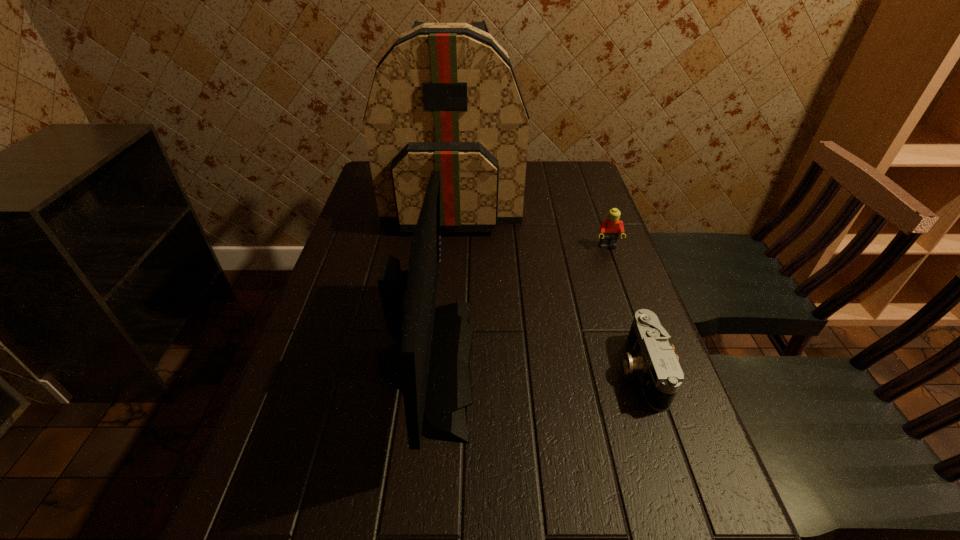
The width and height of the screenshot is (960, 540). In order to click on vacant space in between the second tallest object and the Lego in this screenshot , I will do `click(516, 305)`.

Image resolution: width=960 pixels, height=540 pixels. I want to click on free space between the farthest object and the camera, so click(547, 285).

I want to click on vacant space that is in between the monitor and the shortest object, so click(534, 367).

Locate an element on the screen. This screenshot has width=960, height=540. free point between the backpack and the third tallest object is located at coordinates (531, 223).

At what (x,y) coordinates should I click in order to perform the action: click on vacant area between the Lego and the third shortest object. Please return your answer as a coordinate pair (x, y). Looking at the image, I should click on (516, 305).

Find the location of a particular element. empty space between the second farthest object and the shortest object is located at coordinates click(625, 308).

The height and width of the screenshot is (540, 960). I want to click on free spot between the monitor and the third nearest object, so click(x=516, y=305).

Identify the location of free area in between the monitor and the backpack. This screenshot has width=960, height=540. (440, 281).

At what (x,y) coordinates should I click in order to perform the action: click on vacant space that is in between the monitor and the Lego. Please return your answer as a coordinate pair (x, y). The width and height of the screenshot is (960, 540). Looking at the image, I should click on (516, 305).

The height and width of the screenshot is (540, 960). Find the location of `vacant area between the third shortest object and the farthest object`. vacant area between the third shortest object and the farthest object is located at coordinates (440, 281).